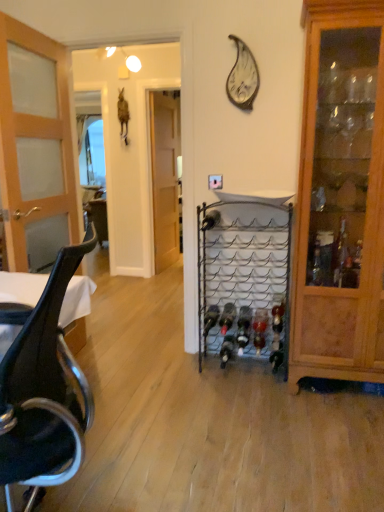
Image resolution: width=384 pixels, height=512 pixels. In order to click on free point in front of wooden cabinet at right in this screenshot , I will do `click(340, 424)`.